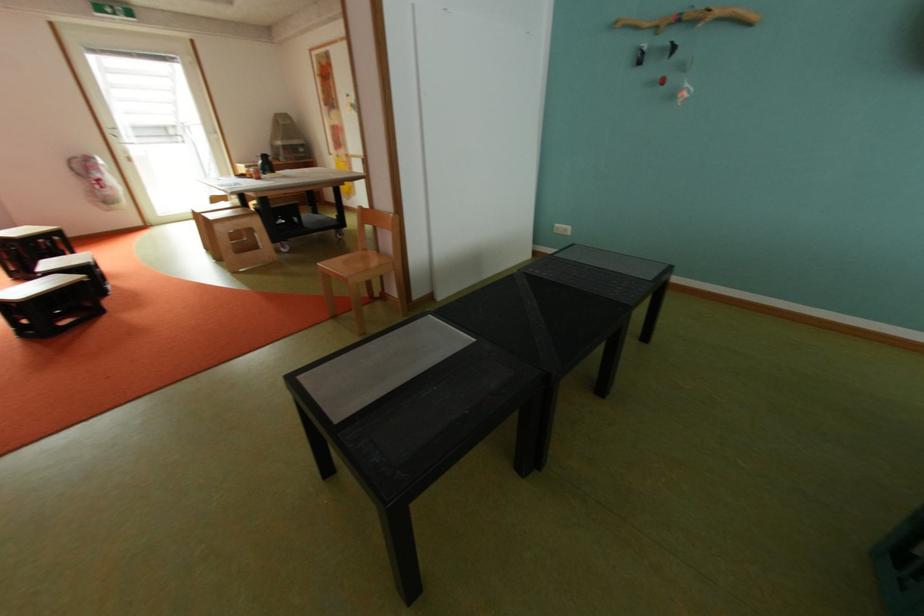
Identify the location of wooden chair seat. The width and height of the screenshot is (924, 616). (365, 265).